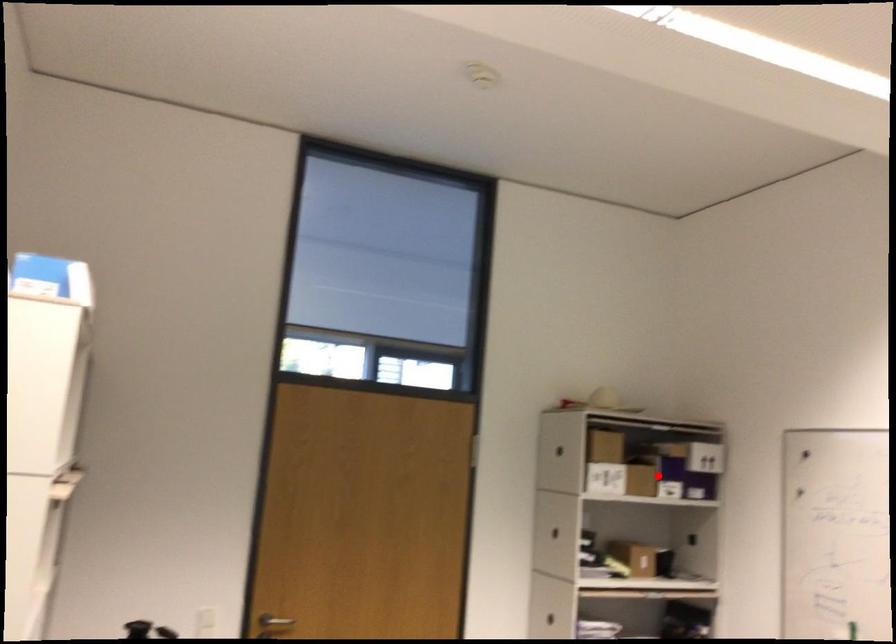
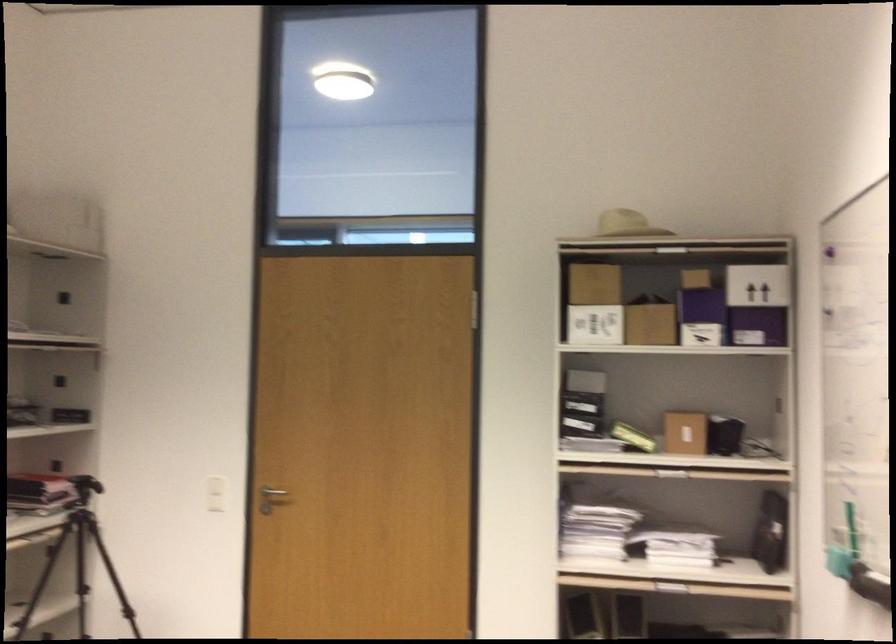
Question: I am providing you with two images of the same scene from different viewpoints. Image1 has a red point marked. In image2, the corresponding 3D location appears at what relative position? Reply with the corresponding letter.

Choices:
 (A) Closer
 (B) Farther

Answer: (A)